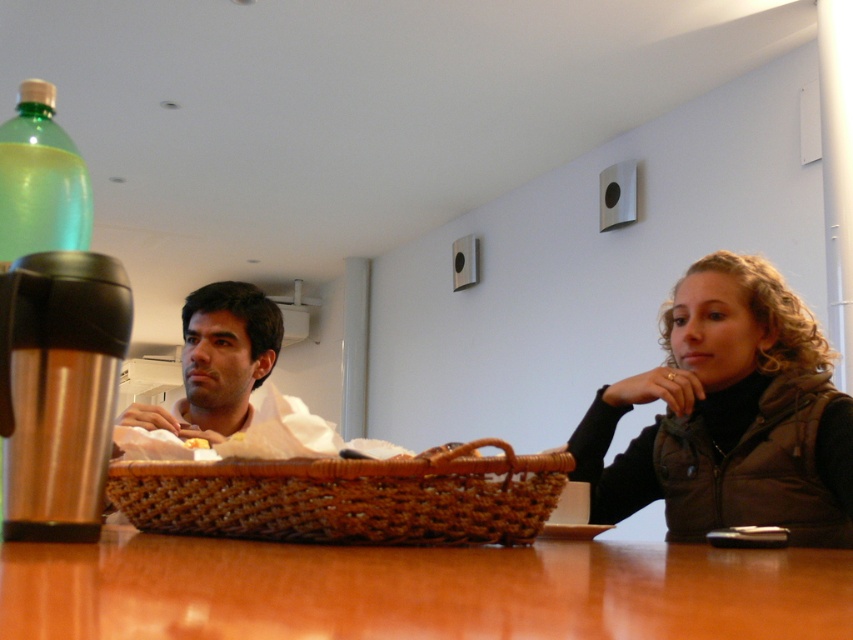
Question: Can you confirm if woven brown basket at center is positioned below brushed metal thermos at left?

Choices:
 (A) yes
 (B) no

Answer: (A)

Question: Does shiny brown table at center have a larger size compared to yellow soft bread at center?

Choices:
 (A) no
 (B) yes

Answer: (B)

Question: Which object appears farthest from the camera in this image?

Choices:
 (A) brushed metal thermos at left
 (B) green translucent bottle at left
 (C) woven brown basket at center
 (D) yellow soft bread at center

Answer: (D)

Question: Estimate the real-world distances between objects in this image. Which object is closer to the shiny brown table at center?

Choices:
 (A) green translucent bottle at left
 (B) yellow soft bread at center
 (C) brushed metal thermos at left
 (D) woven brown basket at center

Answer: (D)

Question: Can you confirm if shiny brown table at center is wider than brown textured vest at right?

Choices:
 (A) yes
 (B) no

Answer: (A)

Question: Among these objects, which one is farthest from the camera?

Choices:
 (A) brushed metal thermos at left
 (B) yellow soft bread at center
 (C) green translucent bottle at left

Answer: (B)